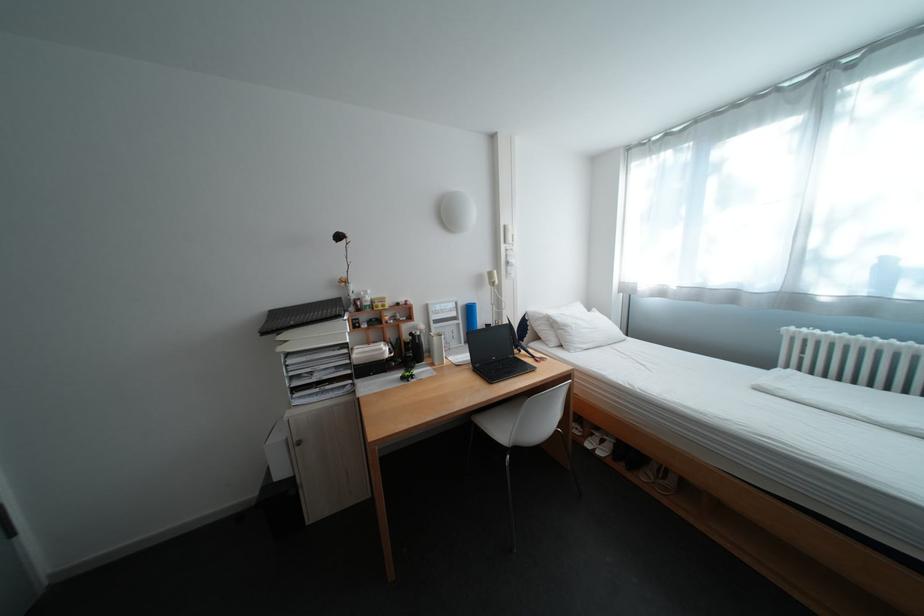
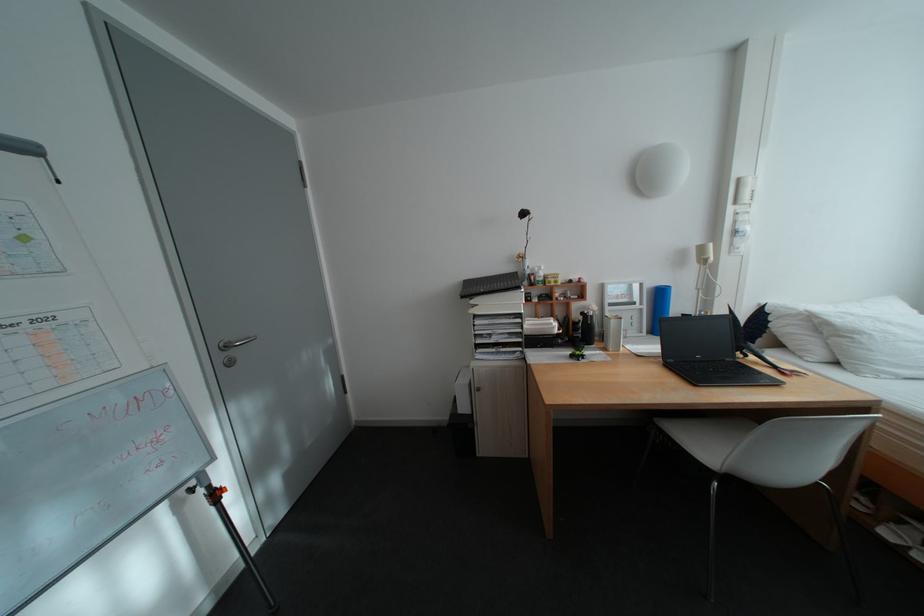
Find the pixel in the second image that matches pixel 444 365 in the first image.

(617, 350)